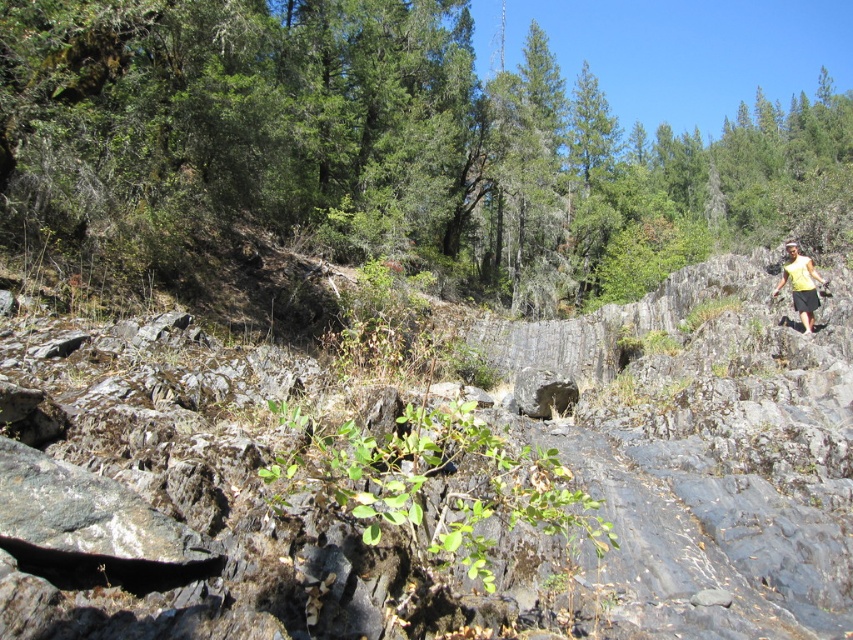
You are a hiker trying to navigate this rocky terrain. You notice a gray rough stone at center and a yellow fabric at right. Which object is shorter in height?

The gray rough stone at center is shorter in height than the yellow fabric at right.

You are a hiker who wants to set up a tent on the yellow fabric at right. However, there is a green leafy tree at center nearby. Will the tree block sunlight from reaching your tent during the day?

The green leafy tree at center is located above the yellow fabric at right, so it will block sunlight from reaching the tent set up on the yellow fabric at right during the day.